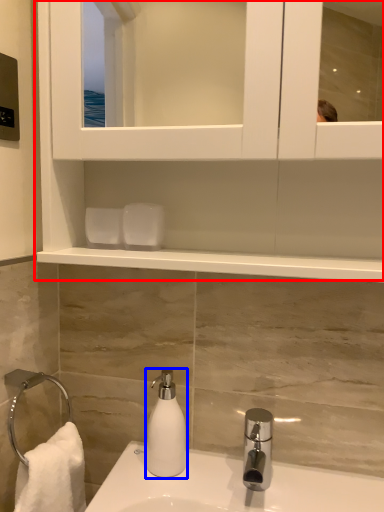
Question: Which point is closer to the camera, cabinet (highlighted by a red box) or soap dispenser (highlighted by a blue box)?

Choices:
 (A) cabinet
 (B) soap dispenser

Answer: (A)